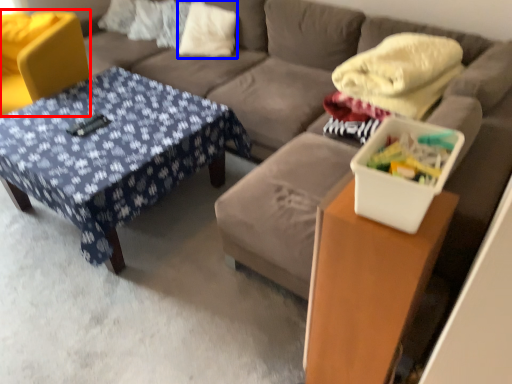
Question: Which object is closer to the camera taking this photo, swivel chair (highlighted by a red box) or pillow (highlighted by a blue box)?

Choices:
 (A) swivel chair
 (B) pillow

Answer: (A)